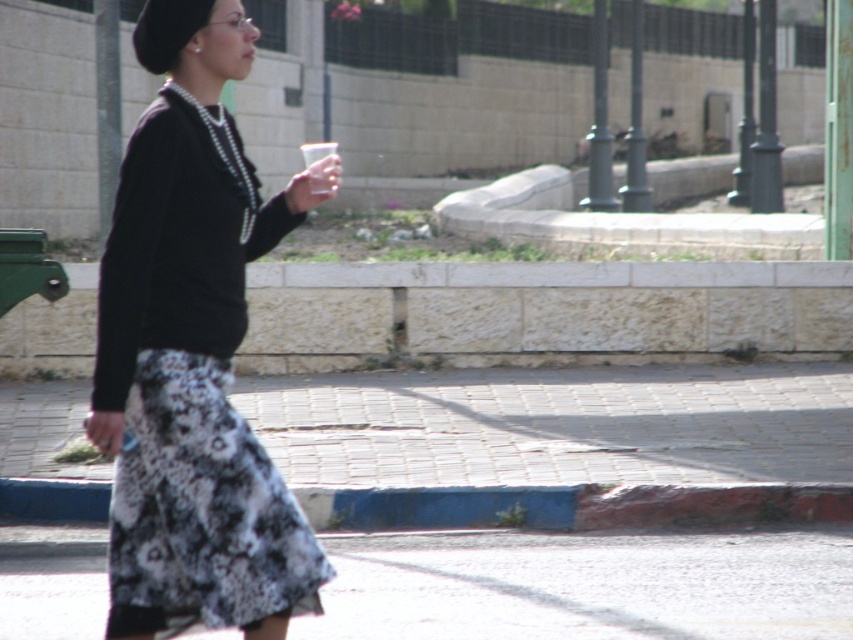
You are a photographer trying to capture the person in the image. The person is wearing a black matte sweater at center. To ensure the sweater is in focus, where should you position your camera relative to the point marked at coordinates (193, 352)?

The point at coordinates (193, 352) indicates the location of the black matte sweater at center, so positioning the camera directly at this point will ensure the sweater is in focus.

What are the coordinates of the black matte sweater at center in the image?

The black matte sweater at center is located at point [193,352].